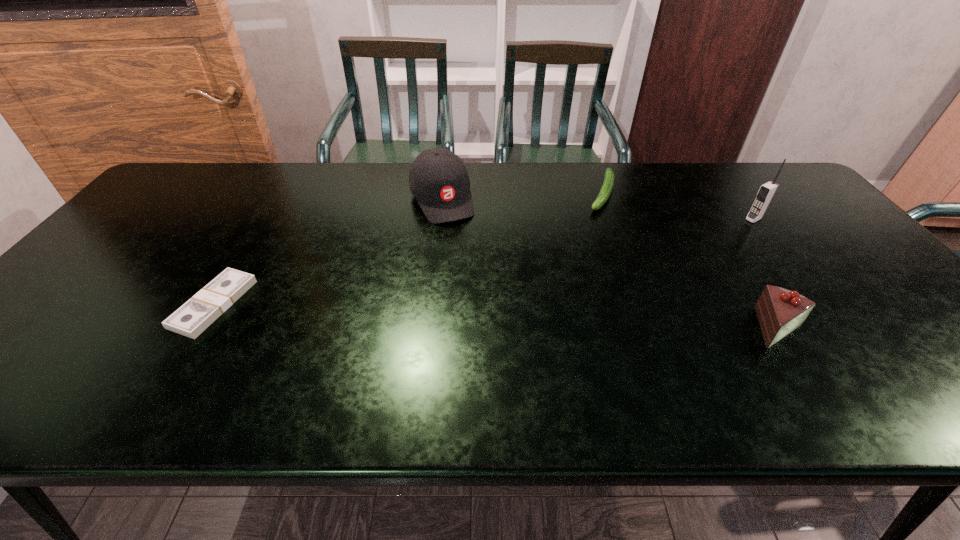
Where is `free space between the dollar and the chocolate cake`? free space between the dollar and the chocolate cake is located at coordinates (495, 315).

You are a GUI agent. You are given a task and a screenshot of the screen. Output one action in this format:
    pyautogui.click(x=<x>, y=<y>)
    Task: Click on the free space between the fourth object from left to right and the leftmost object
    The width and height of the screenshot is (960, 540).
    Given the screenshot: What is the action you would take?
    pyautogui.click(x=495, y=315)

Find the location of a particular element. The width and height of the screenshot is (960, 540). vacant space in between the fourth shortest object and the third object from left to right is located at coordinates (521, 196).

Locate an element on the screen. This screenshot has height=540, width=960. vacant space that's between the third object from left to right and the third shortest object is located at coordinates (689, 260).

I want to click on blank region between the rightmost object and the leftmost object, so click(x=484, y=261).

Find the location of a particular element. The image size is (960, 540). vacant area that lies between the fourth tallest object and the shortest object is located at coordinates (408, 248).

Locate an element on the screen. Image resolution: width=960 pixels, height=540 pixels. unoccupied area between the leftmost object and the third object from right to left is located at coordinates (408, 248).

Identify the location of vacant area that lies between the third object from right to left and the rightmost object. The width and height of the screenshot is (960, 540). (x=678, y=206).

Locate an element on the screen. This screenshot has width=960, height=540. free point between the fourth tallest object and the tallest object is located at coordinates coord(678,206).

Where is `vacant region between the third object from right to left and the dollar`? vacant region between the third object from right to left and the dollar is located at coordinates (408, 248).